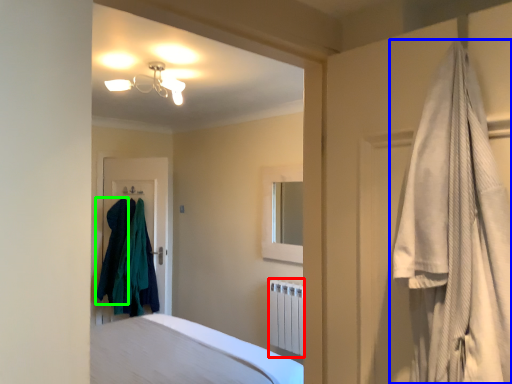
Question: Considering the real-world distances, which object is closest to radiator (highlighted by a red box)? curtain (highlighted by a blue box) or clothing (highlighted by a green box).

Choices:
 (A) curtain
 (B) clothing

Answer: (B)